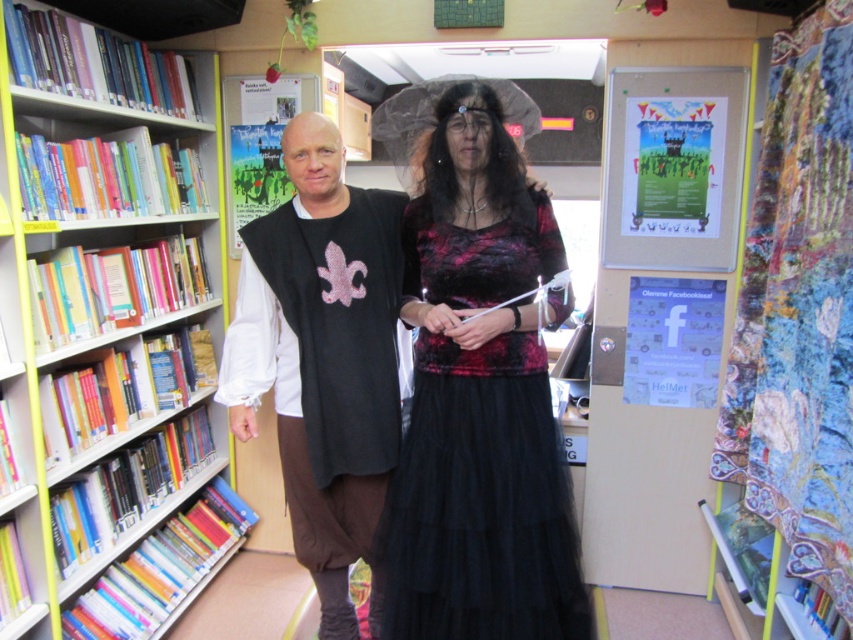
You are standing at the camera position in the library scene. There is a point marked at coordinates point [393,488]. Can you reach this point without moving your feet? Explain your reasoning.

The point [393,488] is 1.77 meters away from the camera. Since the average person cannot reach that distance without moving their feet, you cannot reach the point while staying in place.

You are standing in the library and want to move from the point closer to you to the farther point. Which path should you take? The points are labeled as point (163, 61) and point (374, 312). Please specify the starting and ending points based on their coordinates.

You should start at point (163, 61) and move towards point (374, 312) because point (163, 61) is closer to you, making it the starting point, and point (374, 312) is farther away, so it is the destination.